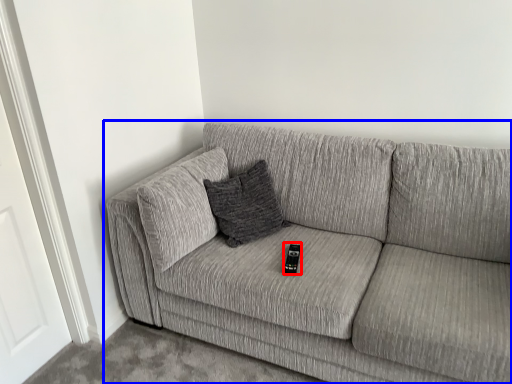
Question: Which object appears farthest to the camera in this image, remote (highlighted by a red box) or studio couch (highlighted by a blue box)?

Choices:
 (A) remote
 (B) studio couch

Answer: (A)